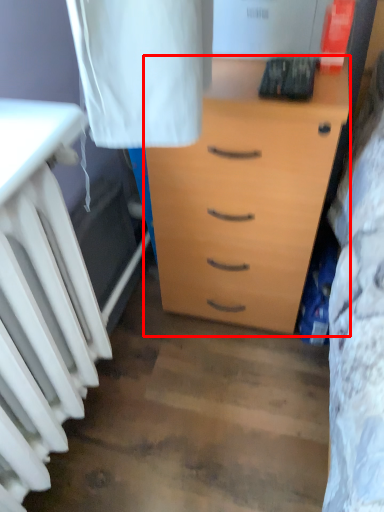
Question: From the image, what is the correct spatial relationship of chest of drawers (annotated by the red box) in relation to radiator?

Choices:
 (A) left
 (B) right

Answer: (B)